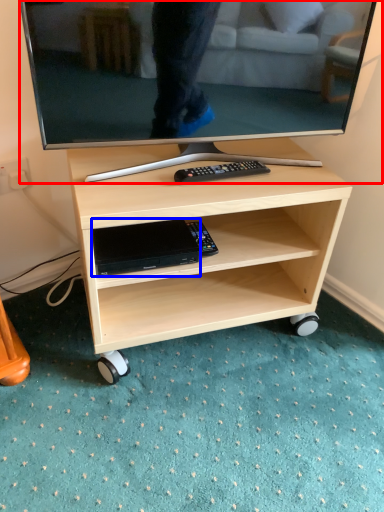
Question: Among these objects, which one is nearest to the camera, television (highlighted by a red box) or gadget (highlighted by a blue box)?

Choices:
 (A) television
 (B) gadget

Answer: (A)